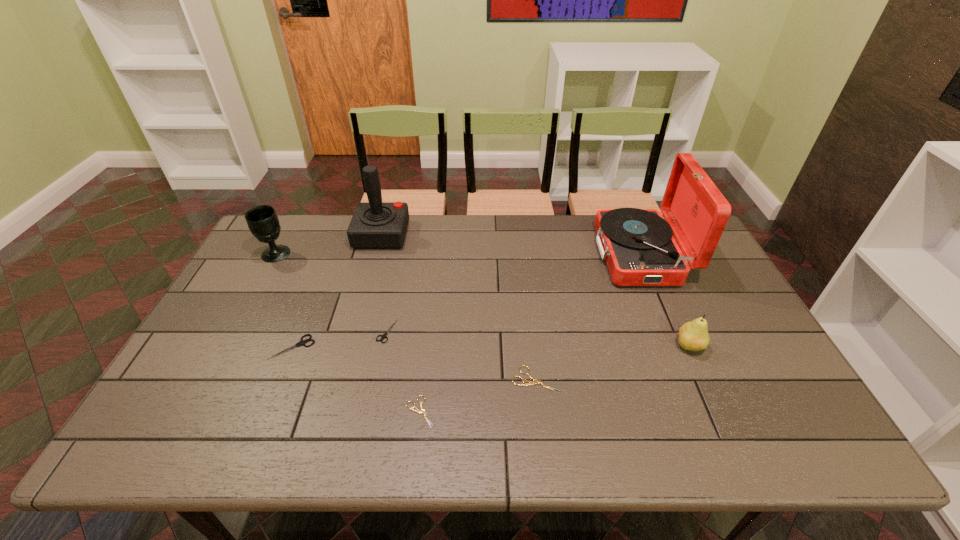
The height and width of the screenshot is (540, 960). Identify the location of object at the far right corner. (638, 246).

The height and width of the screenshot is (540, 960). In the image, there is a desktop. What are the coordinates of `vacant space at the far edge` in the screenshot? It's located at (424, 218).

In the image, there is a desktop. Where is `blank space at the near edge`? The width and height of the screenshot is (960, 540). blank space at the near edge is located at coordinates (573, 445).

Image resolution: width=960 pixels, height=540 pixels. What are the coordinates of `free point at the left edge` in the screenshot? It's located at (225, 396).

You are a GUI agent. You are given a task and a screenshot of the screen. Output one action in this format:
    pyautogui.click(x=<x>, y=<y>)
    Task: Click on the free point at the far left corner
    The image size is (960, 540).
    Given the screenshot: What is the action you would take?
    pyautogui.click(x=306, y=239)

Locate an element on the screen. The height and width of the screenshot is (540, 960). vacant space at the near left corner of the desktop is located at coordinates (192, 418).

Where is `free region at the near right corner`? The width and height of the screenshot is (960, 540). free region at the near right corner is located at coordinates (804, 436).

At what (x,y) coordinates should I click in order to perform the action: click on unoccupied area between the right black shears and the shortest shears. Please return your answer as a coordinate pair (x, y). The image size is (960, 540). Looking at the image, I should click on (403, 371).

Where is `vacant area that lies between the pear and the chalice`? This screenshot has width=960, height=540. vacant area that lies between the pear and the chalice is located at coordinates (483, 301).

This screenshot has width=960, height=540. Identify the location of empty space between the joystick and the nearer beige shears. (401, 323).